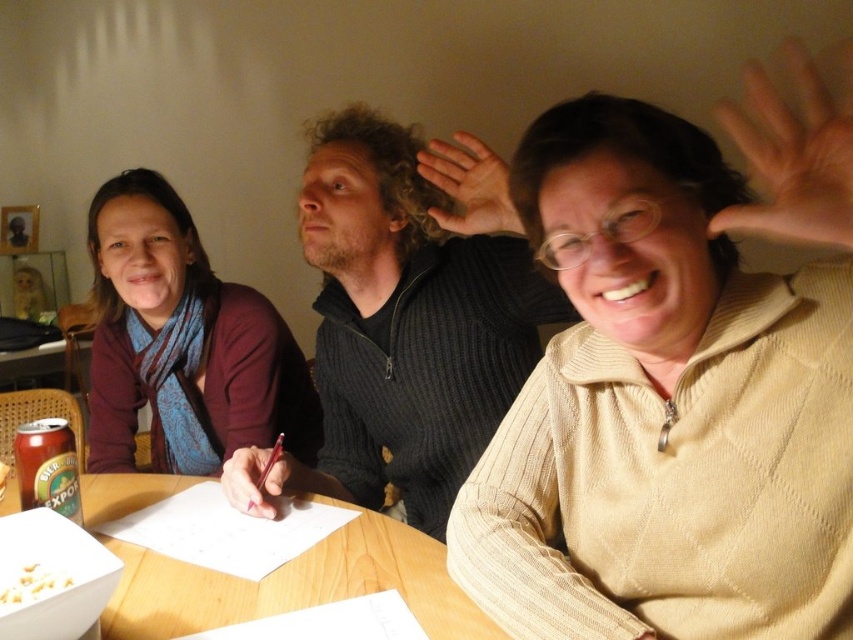
Question: Where is wooden table at center located in relation to matte skin hand at center in the image?

Choices:
 (A) above
 (B) below

Answer: (B)

Question: Can you confirm if maroon sweater at left is wider than yellow crumbly snack at lower left?

Choices:
 (A) no
 (B) yes

Answer: (B)

Question: Estimate the real-world distances between objects in this image. Which object is farther from the dark gray ribbed sweater at center?

Choices:
 (A) light skin palm at upper right
 (B) yellow crumbly snack at lower left

Answer: (A)

Question: Which of the following is the farthest from the observer?

Choices:
 (A) matte skin hand at center
 (B) matte red pen at center

Answer: (B)

Question: Which object is positioned farthest from the matte red pen at center?

Choices:
 (A) light skin palm at upper right
 (B) wooden table at center
 (C) dark gray ribbed sweater at center

Answer: (A)

Question: Does maroon sweater at left have a greater width compared to wooden table at center?

Choices:
 (A) yes
 (B) no

Answer: (B)